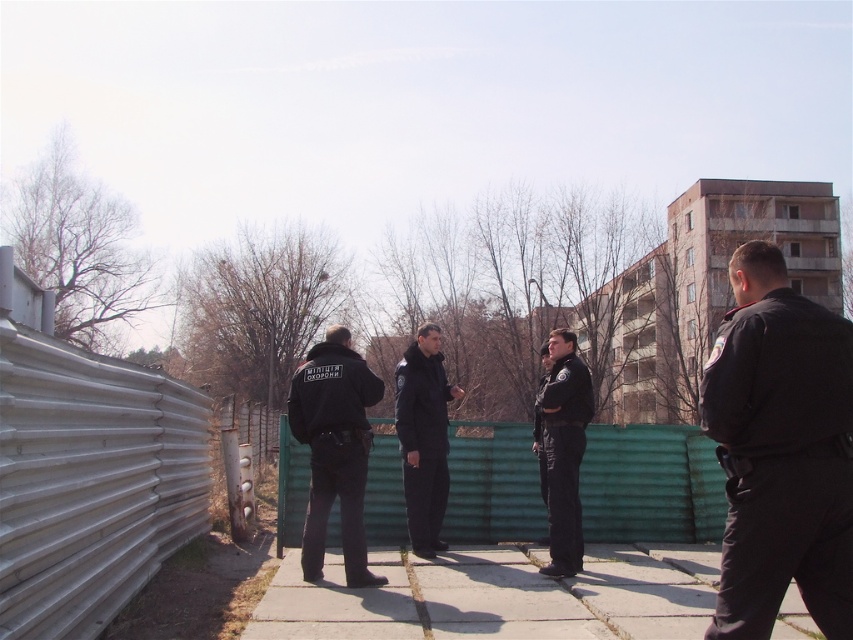
From the picture: Who is lower down, black matte uniform at right or gray concrete pavement at center?

gray concrete pavement at center is lower down.

Is black matte uniform at right smaller than gray concrete pavement at center?

Yes.

Is point (817, 353) less distant than point (407, 570)?

Yes, it is.

Identify the location of black matte uniform at right. The image size is (853, 640). (780, 451).

Can you confirm if green corrugated metal fence at center is bigger than dark blue uniform at center?

Indeed, green corrugated metal fence at center has a larger size compared to dark blue uniform at center.

Can you confirm if green corrugated metal fence at center is positioned below dark blue uniform at center?

Yes, green corrugated metal fence at center is below dark blue uniform at center.

Does point (662, 467) come farther from viewer compared to point (434, 369)?

That is True.

Where is `green corrugated metal fence at center`? green corrugated metal fence at center is located at coordinates (650, 484).

Who is more forward, (x=281, y=609) or (x=587, y=403)?

Positioned in front is point (x=281, y=609).

Who is lower down, gray concrete pavement at center or black uniform at center?

gray concrete pavement at center

At what (x,y) coordinates should I click in order to perform the action: click on gray concrete pavement at center. Please return your answer as a coordinate pair (x, y). The height and width of the screenshot is (640, 853). Looking at the image, I should click on coord(495,596).